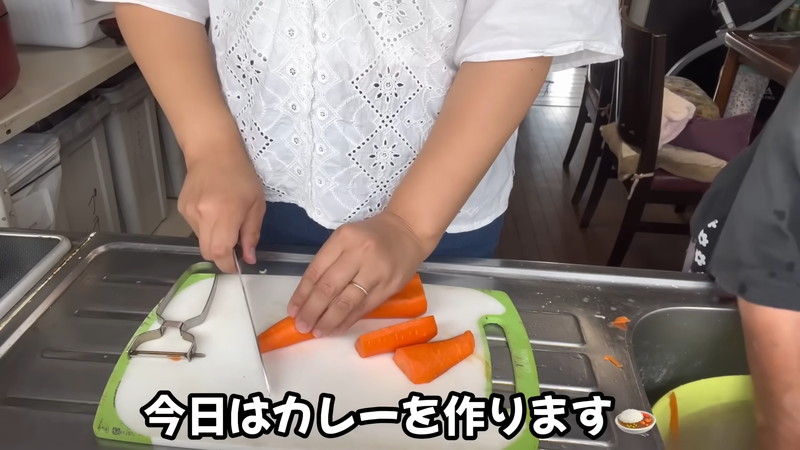
Where is `embroidered flowers`? The width and height of the screenshot is (800, 450). embroidered flowers is located at coordinates (384, 13), (380, 85), (381, 157), (374, 208), (241, 138), (242, 75), (225, 19).